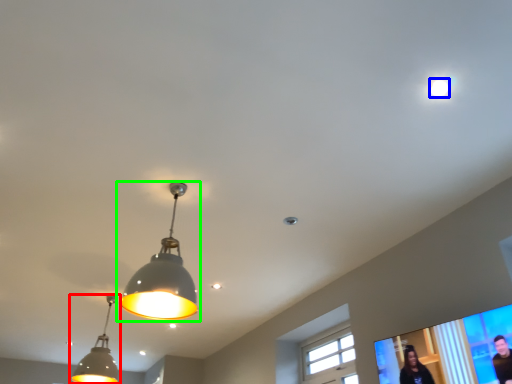
Question: Which object is the farthest from lamp (highlighted by a red box)? Choose among these: droplight (highlighted by a blue box) or lamp (highlighted by a green box).

Choices:
 (A) droplight
 (B) lamp

Answer: (A)